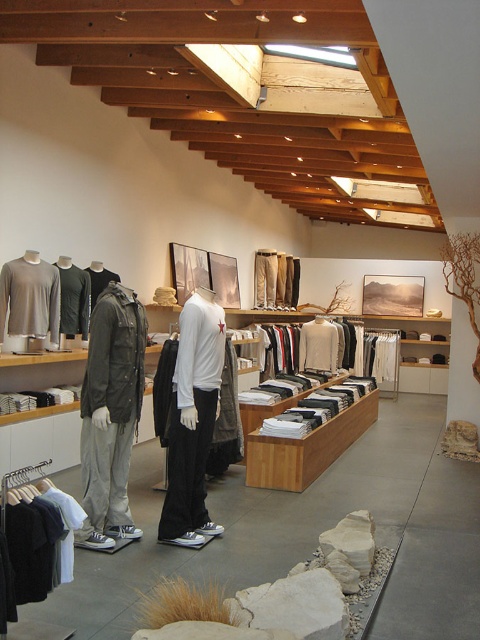
Question: Where is matte gray long-sleeve shirt at center located in relation to matte green t-shirt at center in the image?

Choices:
 (A) above
 (B) below

Answer: (B)

Question: Which of these objects is positioned farthest from the white matte t-shirt at center?

Choices:
 (A) matte green t-shirt at center
 (B) matte black jacket at left
 (C) dark gray cotton t-shirt at lower left

Answer: (C)

Question: Can you confirm if dark gray cotton t-shirt at lower left is positioned below dark gray wool jacket at center?

Choices:
 (A) yes
 (B) no

Answer: (A)

Question: Estimate the real-world distances between objects in this image. Which object is closer to the dark gray wool jacket at center?

Choices:
 (A) dark gray cotton t-shirt at lower left
 (B) white matte t-shirt at center
 (C) matte green t-shirt at center
 (D) white matte long-sleeve shirt at center

Answer: (C)

Question: Where is white matte long-sleeve shirt at center located in relation to dark gray wool jacket at center in the image?

Choices:
 (A) above
 (B) below

Answer: (B)

Question: Which of these objects is positioned farthest from the white matte t-shirt at center?

Choices:
 (A) dark gray wool jacket at center
 (B) matte black jacket at left

Answer: (B)